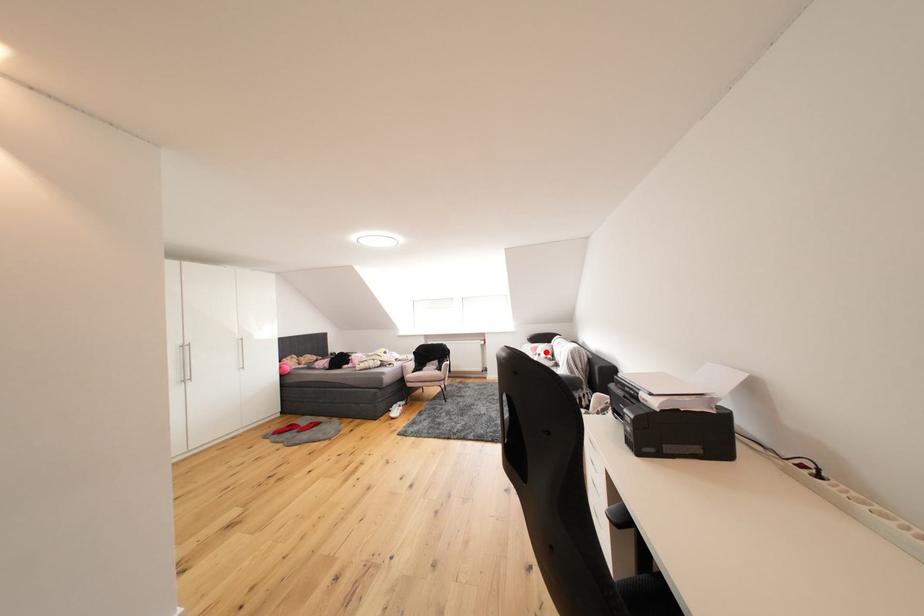
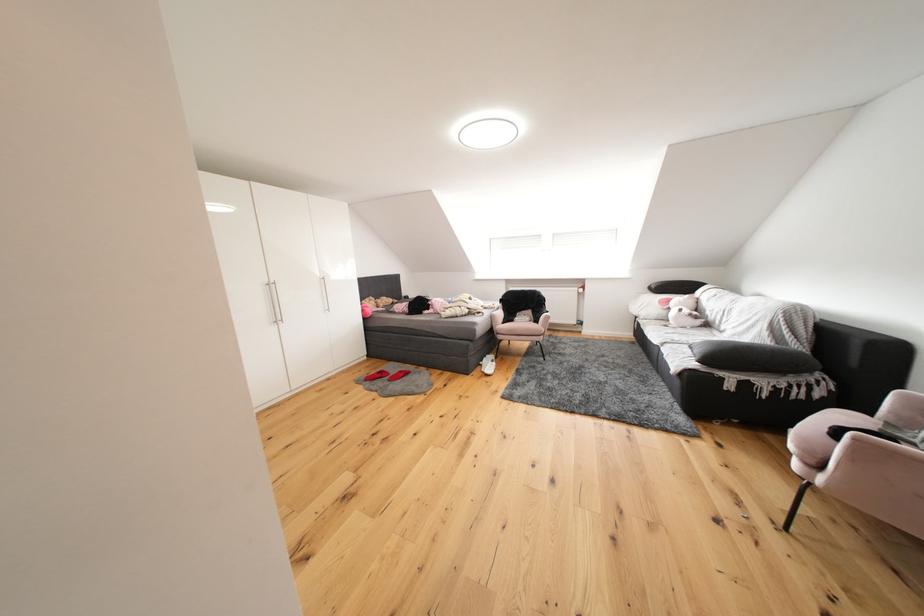
The point at the highlighted location is marked in the first image. Where is the corresponding point in the second image?

(677, 305)